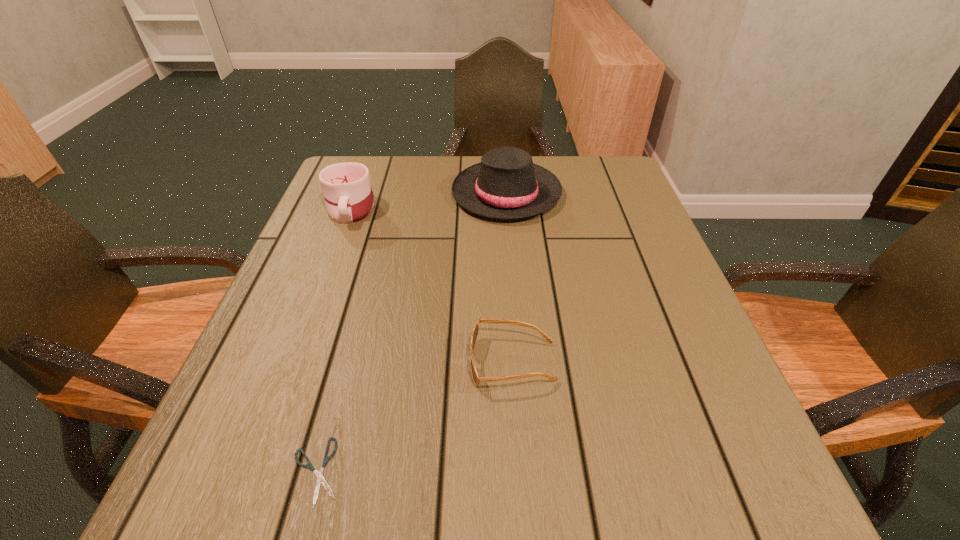
The height and width of the screenshot is (540, 960). In order to click on dress hat in this screenshot , I will do `click(506, 184)`.

This screenshot has width=960, height=540. Find the location of `mug`. mug is located at coordinates (348, 194).

This screenshot has width=960, height=540. Find the location of `sunglasses`. sunglasses is located at coordinates (476, 379).

You are a GUI agent. You are given a task and a screenshot of the screen. Output one action in this format:
    pyautogui.click(x=<x>, y=<y>)
    Task: Click on the third tallest object
    
    Given the screenshot: What is the action you would take?
    pyautogui.click(x=476, y=379)

At what (x,y) coordinates should I click in order to perform the action: click on the nearest object. Please return your answer as a coordinate pair (x, y). This screenshot has width=960, height=540. Looking at the image, I should click on (320, 479).

The height and width of the screenshot is (540, 960). I want to click on the shortest object, so click(320, 479).

This screenshot has height=540, width=960. I want to click on vacant area situated on the front of the dress hat, so click(x=517, y=330).

The width and height of the screenshot is (960, 540). I want to click on blank space located 0.180m on the side with the handle of the mug, so click(324, 282).

This screenshot has height=540, width=960. What are the coordinates of `free space located 0.190m on the front-facing side of the third farthest object` in the screenshot? It's located at 360,362.

Where is `free space located 0.290m on the front-facing side of the third farthest object`? The image size is (960, 540). free space located 0.290m on the front-facing side of the third farthest object is located at coordinates (301, 362).